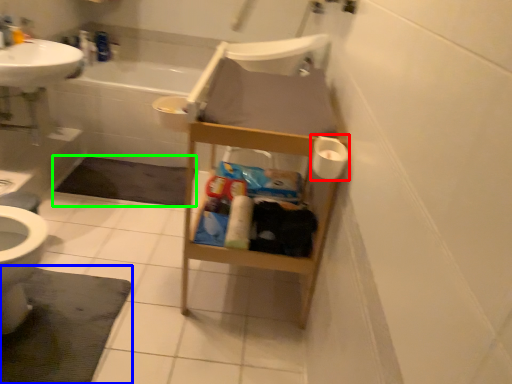
Question: Estimate the real-world distances between objects in this image. Which object is closer to toilet paper (highlighted by a red box), bath mat (highlighted by a blue box) or bath mat (highlighted by a green box)?

Choices:
 (A) bath mat
 (B) bath mat

Answer: (A)